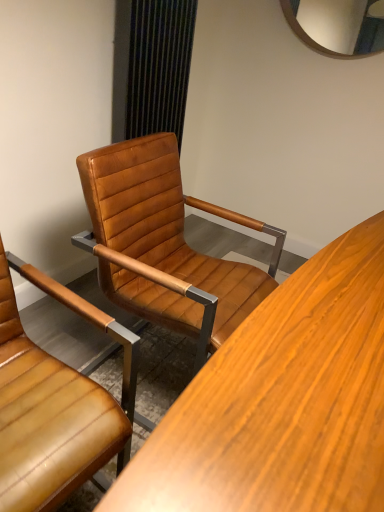
Question: Would you say leather at center, the first chair from the left, is part of black textured curtain at upper center's contents?

Choices:
 (A) no
 (B) yes

Answer: (A)

Question: Is black textured curtain at upper center next to leather at center, the first chair from the left?

Choices:
 (A) yes
 (B) no

Answer: (B)

Question: Can you confirm if black textured curtain at upper center is bigger than leather at center, the second chair in the right-to-left sequence?

Choices:
 (A) yes
 (B) no

Answer: (B)

Question: From the image's perspective, would you say black textured curtain at upper center is positioned over leather at center, the second chair in the right-to-left sequence?

Choices:
 (A) no
 (B) yes

Answer: (B)

Question: From a real-world perspective, is black textured curtain at upper center beneath leather at center, the first chair from the left?

Choices:
 (A) yes
 (B) no

Answer: (B)

Question: From a real-world perspective, is leather at center, the first chair from the left, above or below leather at center, which ranks as the 1th chair in right-to-left order?

Choices:
 (A) above
 (B) below

Answer: (B)

Question: In terms of size, does leather at center, the first chair from the left, appear bigger or smaller than leather at center, which ranks as the second chair in left-to-right order?

Choices:
 (A) small
 (B) big

Answer: (A)

Question: Visually, is leather at center, the second chair in the right-to-left sequence, positioned to the left or to the right of leather at center, which ranks as the 1th chair in right-to-left order?

Choices:
 (A) left
 (B) right

Answer: (A)

Question: Is leather at center, the first chair from the left, wider or thinner than leather at center, which ranks as the second chair in left-to-right order?

Choices:
 (A) thin
 (B) wide

Answer: (A)

Question: From their relative heights in the image, would you say black textured curtain at upper center is taller or shorter than leather at center, the second chair in the right-to-left sequence?

Choices:
 (A) tall
 (B) short

Answer: (A)

Question: Based on their sizes in the image, would you say black textured curtain at upper center is bigger or smaller than leather at center, the first chair from the left?

Choices:
 (A) big
 (B) small

Answer: (B)

Question: In the image, is black textured curtain at upper center positioned in front of or behind leather at center, the first chair from the left?

Choices:
 (A) behind
 (B) front

Answer: (A)

Question: From the image's perspective, is black textured curtain at upper center positioned above or below leather at center, the second chair in the right-to-left sequence?

Choices:
 (A) below
 (B) above

Answer: (B)

Question: Is black textured curtain at upper center taller or shorter than leather at center, which ranks as the 1th chair in right-to-left order?

Choices:
 (A) short
 (B) tall

Answer: (A)

Question: From a real-world perspective, is black textured curtain at upper center physically located above or below leather at center, which ranks as the second chair in left-to-right order?

Choices:
 (A) above
 (B) below

Answer: (A)